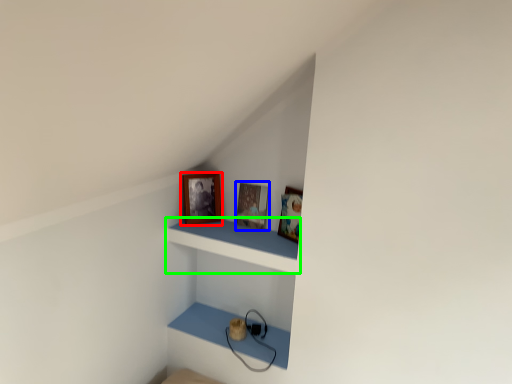
Question: Which is nearer to the picture frame (highlighted by a red box)? picture frame (highlighted by a blue box) or shelf (highlighted by a green box).

Choices:
 (A) picture frame
 (B) shelf

Answer: (A)